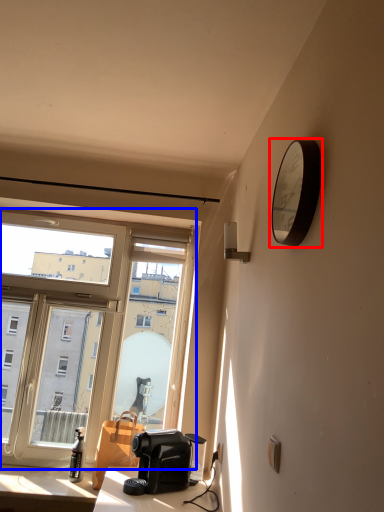
Question: Among these objects, which one is farthest to the camera, clock (highlighted by a red box) or window (highlighted by a blue box)?

Choices:
 (A) clock
 (B) window

Answer: (B)